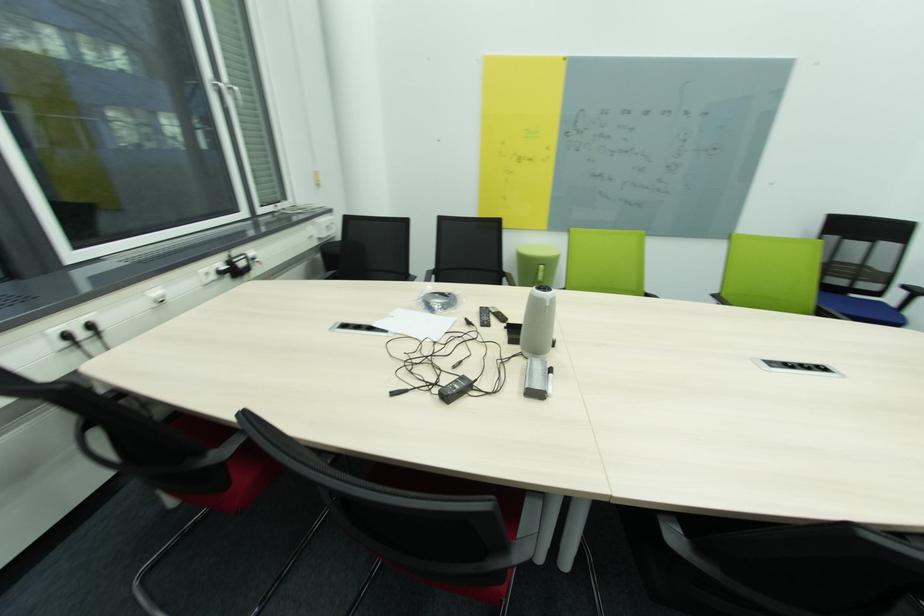
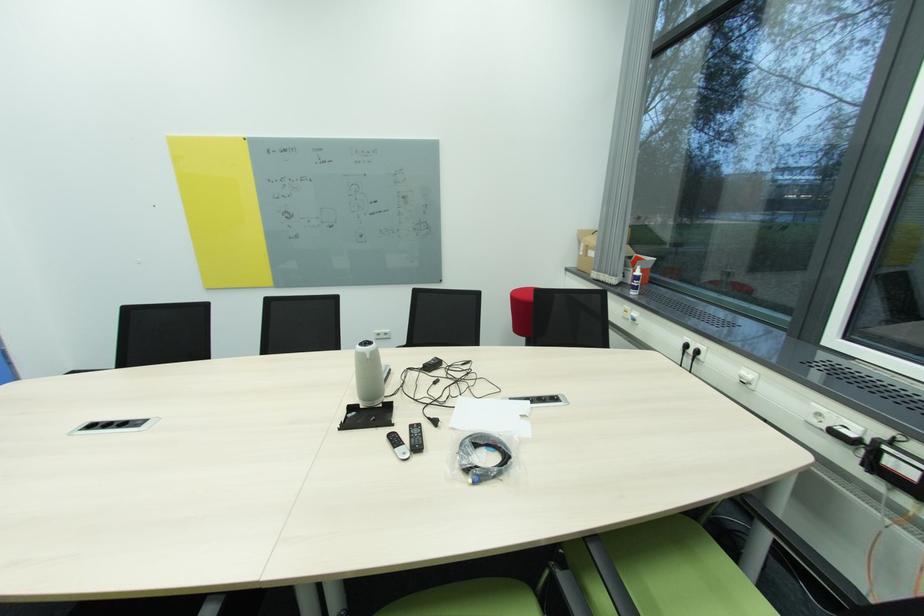
In the second image, find the point that corresponds to [493,326] in the first image.

(416, 427)